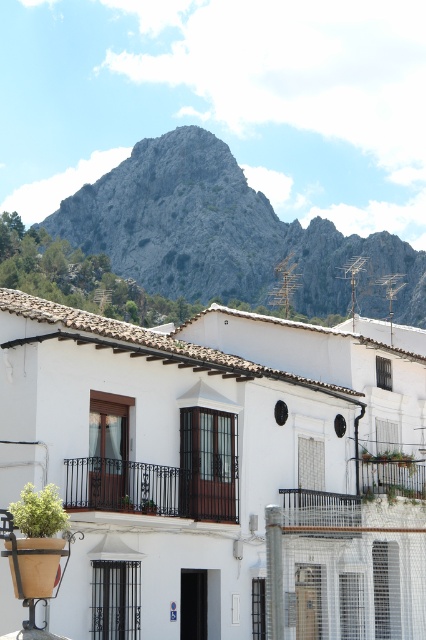
Is rugged stone mountain at upper center behind black wrought iron balcony at center?

Yes, rugged stone mountain at upper center is further from the viewer.

From the picture: Between rugged stone mountain at upper center and black wrought iron balcony at center, which one has less height?

black wrought iron balcony at center

Does point (127, 184) come behind point (101, 480)?

Yes, point (127, 184) is farther from viewer.

Where is `rugged stone mountain at upper center`? rugged stone mountain at upper center is located at coordinates (224, 234).

Is black wrought iron balcony at center smaller than metallic black balcony at center?

No, black wrought iron balcony at center is not smaller than metallic black balcony at center.

How much distance is there between black wrought iron balcony at center and metallic black balcony at center?

The distance of black wrought iron balcony at center from metallic black balcony at center is 63.82 feet.

Is point (66, 497) positioned after point (367, 484)?

No, (66, 497) is closer to viewer.

At what (x,y) coordinates should I click in order to perform the action: click on black wrought iron balcony at center. Please return your answer as a coordinate pair (x, y). Looking at the image, I should click on (154, 486).

Who is taller, rugged stone mountain at upper center or metallic black balcony at center?

With more height is rugged stone mountain at upper center.

Who is more forward, (230, 248) or (367, 460)?

Positioned in front is point (367, 460).

Where is `rugged stone mountain at upper center`? The image size is (426, 640). rugged stone mountain at upper center is located at coordinates (224, 234).